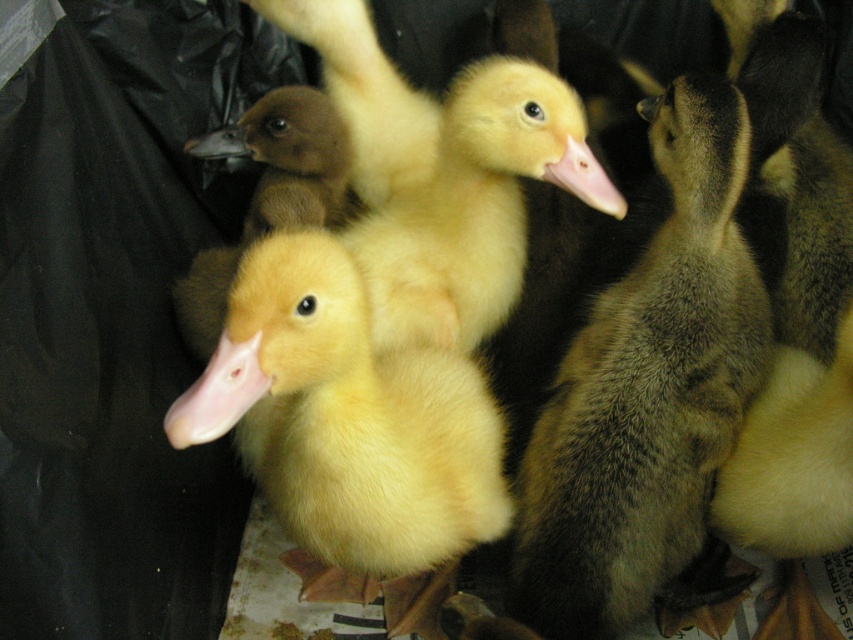
This screenshot has width=853, height=640. Describe the element at coordinates (647, 388) in the screenshot. I see `soft yellow duckling at center` at that location.

Does soft yellow duckling at center have a larger size compared to yellow fluffy duckling at center?

No, soft yellow duckling at center is not bigger than yellow fluffy duckling at center.

Describe the element at coordinates (647, 388) in the screenshot. I see `soft yellow duckling at center` at that location.

Identify the location of soft yellow duckling at center. The width and height of the screenshot is (853, 640). (647, 388).